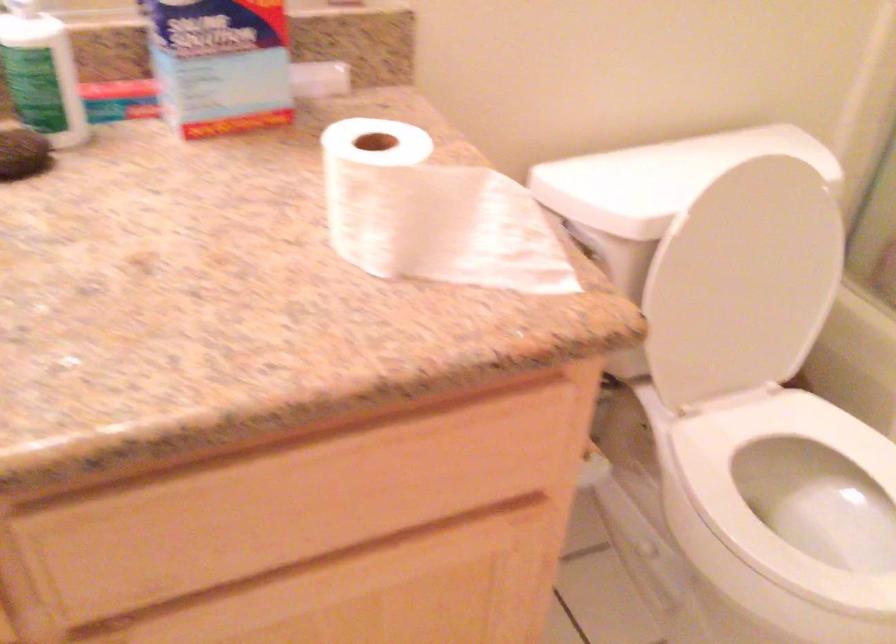
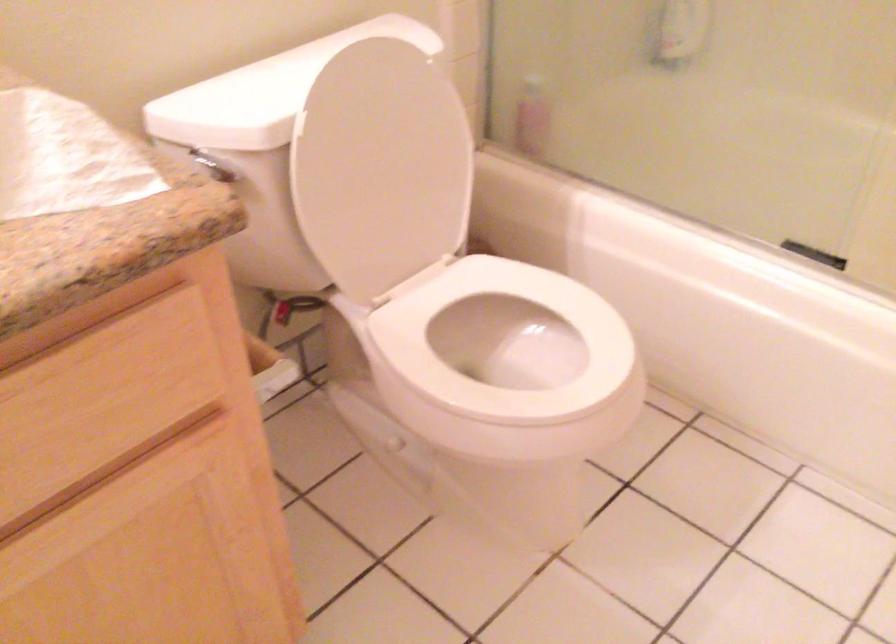
Locate, in the second image, the point that corresponds to (x=475, y=511) in the first image.

(164, 440)